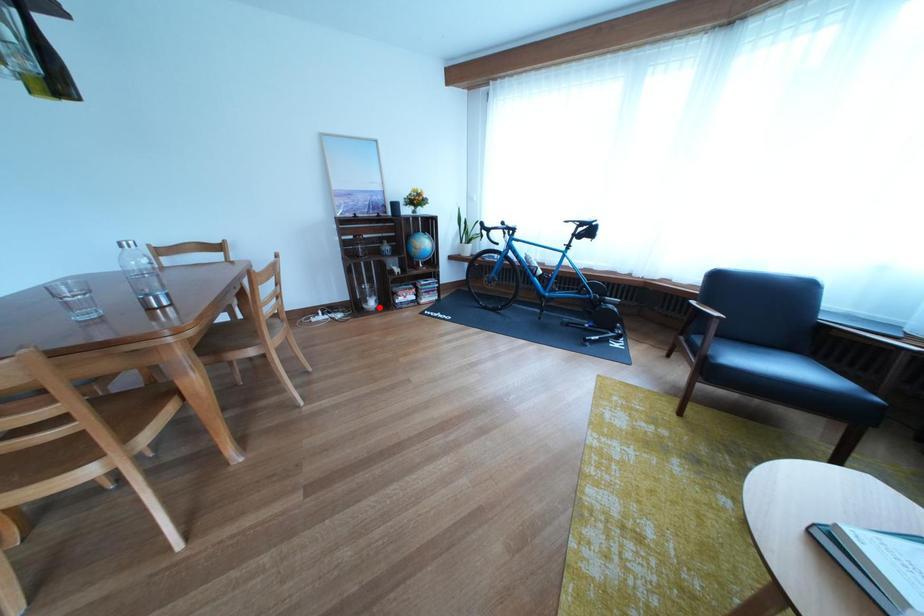
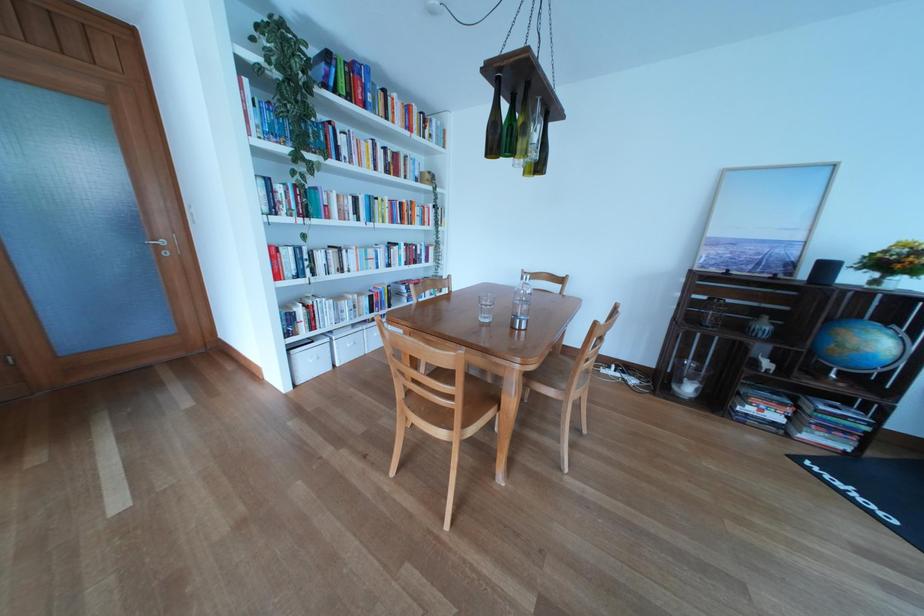
Find the pixel in the second image that matches the highlighted location in the first image.

(694, 389)